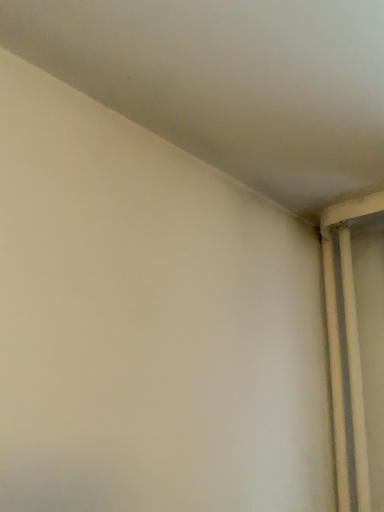
What are the coordinates of `transparent glass door at right` in the screenshot? It's located at (346, 347).

The image size is (384, 512). Describe the element at coordinates (346, 347) in the screenshot. I see `transparent glass door at right` at that location.

Locate an element on the screen. transparent glass door at right is located at coordinates (346, 347).